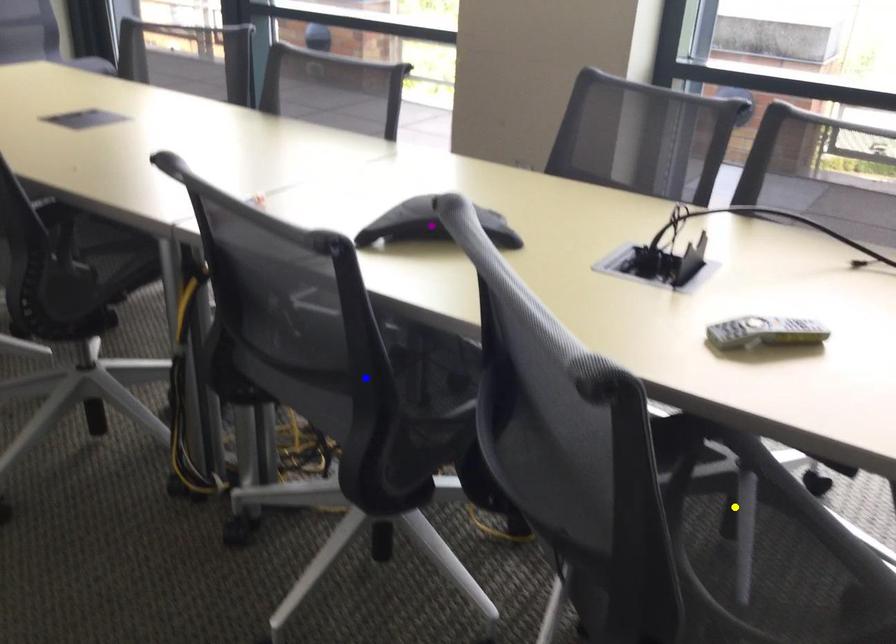
Order these from nearest to farthest:
- yellow point
- purple point
- blue point

yellow point
purple point
blue point